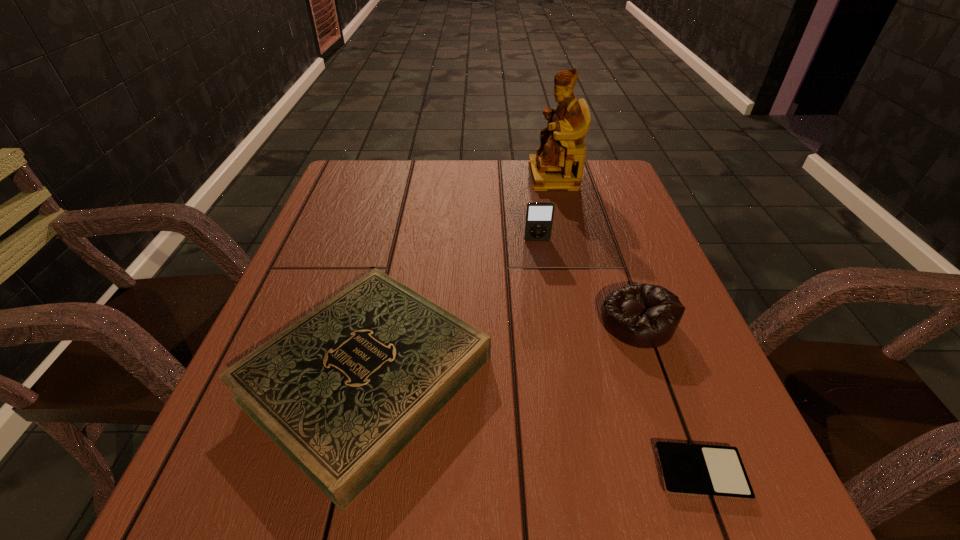
Locate an element on the screen. blank region between the right iPod and the beanbag is located at coordinates (669, 397).

Point out which object is positioned as the third nearest to the beanbag. Please provide its 2D coordinates. Your answer should be formatted as a tuple, i.e. [(x, y)], where the tuple contains the x and y coordinates of a point satisfying the conditions above.

[(343, 390)]

The height and width of the screenshot is (540, 960). What are the coordinates of `the closest object to the left iPod` in the screenshot? It's located at (343, 390).

At what (x,y) coordinates should I click in order to perform the action: click on free point that satisfies the following two spatial constraints: 1. on the front-facing side of the fourth shortest object; 2. on the left side of the shortest object. Please return your answer as a coordinate pair (x, y). The height and width of the screenshot is (540, 960). Looking at the image, I should click on (574, 472).

Find the location of `vacant area that satisfies the following two spatial constraints: 1. on the front-facing side of the tallest object; 2. on the front side of the hardback book`. vacant area that satisfies the following two spatial constraints: 1. on the front-facing side of the tallest object; 2. on the front side of the hardback book is located at coordinates (603, 376).

Where is `blank area in the image that satisfies the following two spatial constraints: 1. on the front side of the beanbag; 2. on the right side of the shortest object`? blank area in the image that satisfies the following two spatial constraints: 1. on the front side of the beanbag; 2. on the right side of the shortest object is located at coordinates (690, 472).

Where is `free location that satisfies the following two spatial constraints: 1. on the front-facing side of the second farthest object; 2. on the left side of the shortest object`? The height and width of the screenshot is (540, 960). free location that satisfies the following two spatial constraints: 1. on the front-facing side of the second farthest object; 2. on the left side of the shortest object is located at coordinates (574, 472).

Where is `blank area in the image that satisfies the following two spatial constraints: 1. on the front-facing side of the beanbag; 2. on the left side of the tallest object`? This screenshot has width=960, height=540. blank area in the image that satisfies the following two spatial constraints: 1. on the front-facing side of the beanbag; 2. on the left side of the tallest object is located at coordinates (589, 321).

You are a GUI agent. You are given a task and a screenshot of the screen. Output one action in this format:
    pyautogui.click(x=<x>, y=<y>)
    Task: Click on the free space that satisfies the following two spatial constraints: 1. on the front-facing side of the taller iPod; 2. on the right side of the beanbag
    
    Given the screenshot: What is the action you would take?
    pyautogui.click(x=550, y=321)

This screenshot has height=540, width=960. In order to click on free point that satisfies the following two spatial constraints: 1. on the back side of the nearer iPod; 2. on the front-facing side of the tallest object in this screenshot , I will do `click(590, 177)`.